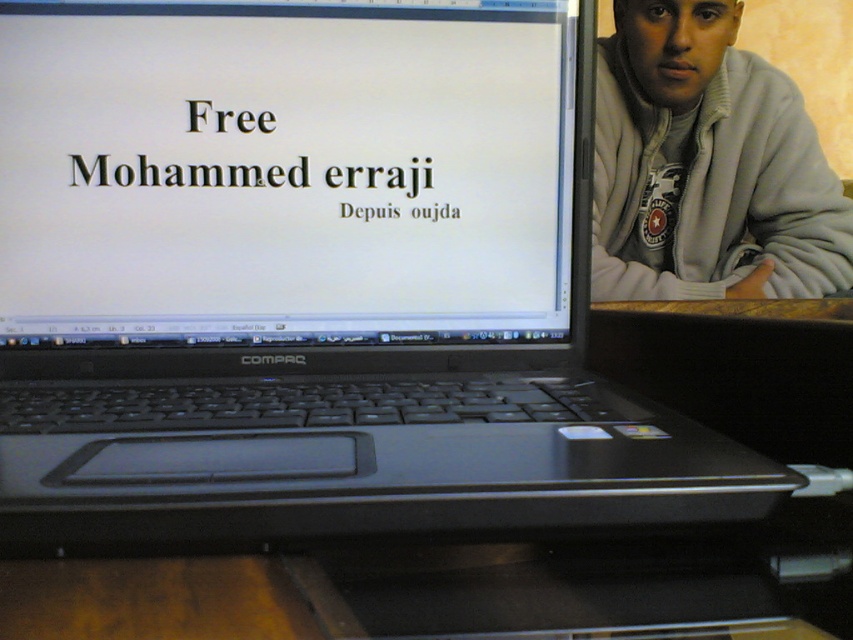
Who is shorter, white matte screen at center or gray fleece jacket at upper right?

With less height is white matte screen at center.

Does white matte screen at center have a lesser height compared to gray fleece jacket at upper right?

Yes, white matte screen at center is shorter than gray fleece jacket at upper right.

Does point (175, 168) come behind point (694, 224)?

No.

Identify the location of white matte screen at center. (285, 172).